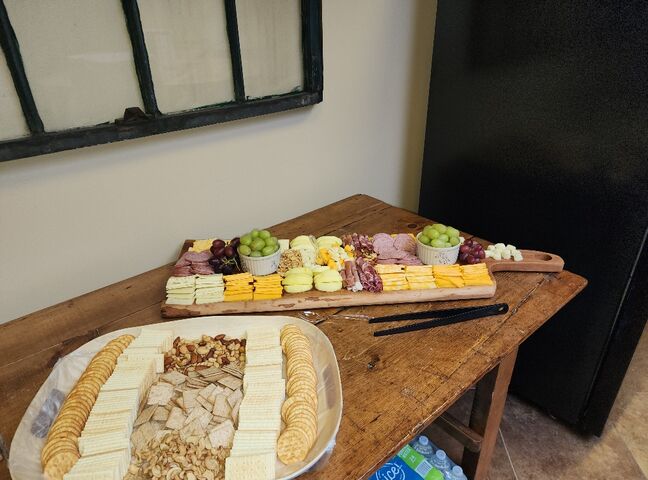
Find the location of a particular element. The width and height of the screenshot is (648, 480). wall is located at coordinates (164, 207).